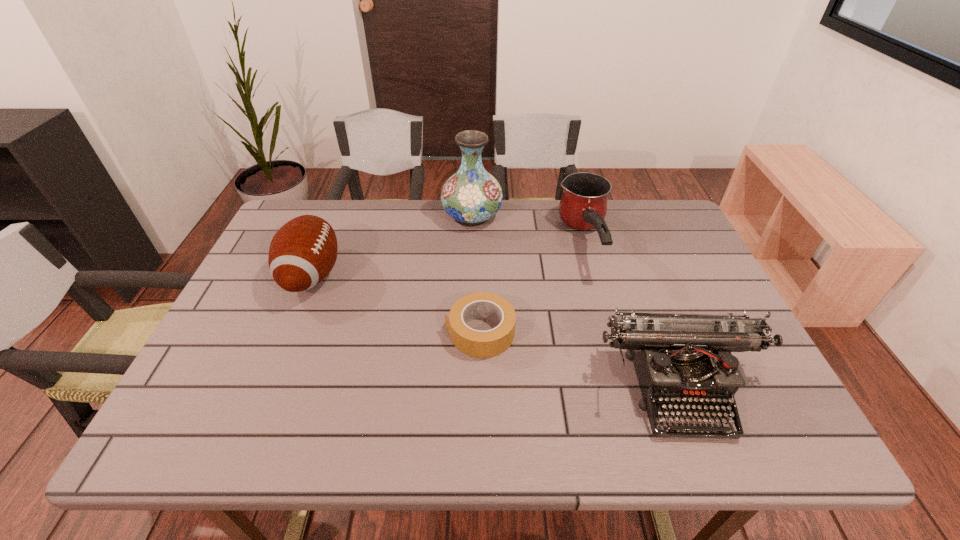
Locate an element on the screen. Image resolution: width=960 pixels, height=540 pixels. the tallest object is located at coordinates (471, 196).

Locate an element on the screen. This screenshot has width=960, height=540. football is located at coordinates (303, 251).

Identify the location of saucepan. (583, 206).

Where is `typewriter`? typewriter is located at coordinates (682, 361).

In order to click on duct tape in this screenshot , I will do `click(481, 344)`.

The height and width of the screenshot is (540, 960). In order to click on vacant space located on the front of the tallest object in this screenshot , I will do `click(471, 265)`.

The width and height of the screenshot is (960, 540). Identify the location of vacant space located 0.190m on the laces of the leftmost object. (412, 275).

Find the location of a particular element. The width and height of the screenshot is (960, 540). blank space located 0.050m on the handle side of the saucepan is located at coordinates (601, 298).

Locate an element on the screen. vacant region located at the edge of the shortest object is located at coordinates (379, 332).

Find the location of `vacant space positioned 0.340m at the edge of the shortest object`. vacant space positioned 0.340m at the edge of the shortest object is located at coordinates (304, 332).